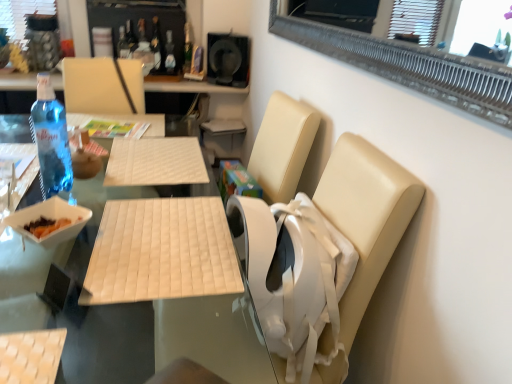
Question: Does white quilted placemat at center, the second table from the top, have a lesser height compared to transparent plastic bottle at upper center, the second bottle in the bottom-to-top sequence?

Choices:
 (A) yes
 (B) no

Answer: (B)

Question: Is white quilted placemat at center, the second table from the top, behind transparent plastic bottle at upper center, acting as the 3th bottle starting from the top?

Choices:
 (A) yes
 (B) no

Answer: (B)

Question: Does white quilted placemat at center, acting as the first table starting from the bottom, have a lesser width compared to transparent plastic bottle at upper center, the second bottle in the bottom-to-top sequence?

Choices:
 (A) yes
 (B) no

Answer: (B)

Question: Is white quilted placemat at center, the second table from the top, closer to camera compared to transparent plastic bottle at upper center, marked as the second bottle in a back-to-front arrangement?

Choices:
 (A) no
 (B) yes

Answer: (B)

Question: Does white quilted placemat at center, acting as the first table starting from the bottom, appear on the left side of transparent plastic bottle at upper center, marked as the second bottle in a back-to-front arrangement?

Choices:
 (A) yes
 (B) no

Answer: (A)

Question: From the image's perspective, is white quilted placemat at center, the second table from the top, on transparent plastic bottle at upper center, acting as the 3th bottle starting from the top?

Choices:
 (A) yes
 (B) no

Answer: (B)

Question: Can white quilted mat at center, marked as the first table in a top-to-bottom arrangement, be found inside white quilted placemat at center, the second table from the top?

Choices:
 (A) no
 (B) yes

Answer: (B)

Question: Can you confirm if white quilted placemat at center, the second table from the top, is thinner than white quilted mat at center, the second table in the bottom-to-top sequence?

Choices:
 (A) yes
 (B) no

Answer: (B)

Question: Is white quilted placemat at center, the second table from the top, positioned beyond the bounds of white quilted mat at center, marked as the first table in a top-to-bottom arrangement?

Choices:
 (A) no
 (B) yes

Answer: (B)

Question: Is white quilted placemat at center, the second table from the top, looking in the opposite direction of white quilted mat at center, the second table in the bottom-to-top sequence?

Choices:
 (A) yes
 (B) no

Answer: (B)

Question: From the image's perspective, is white quilted placemat at center, acting as the first table starting from the bottom, located above white quilted mat at center, the second table in the bottom-to-top sequence?

Choices:
 (A) no
 (B) yes

Answer: (A)

Question: Is white quilted placemat at center, the second table from the top, positioned far away from white quilted mat at center, marked as the first table in a top-to-bottom arrangement?

Choices:
 (A) no
 (B) yes

Answer: (A)

Question: Is transparent plastic bottle at upper center, which is the third bottle in front-to-back order, closer to the viewer compared to blue glass bottle at left, positioned as the fourth bottle in back-to-front order?

Choices:
 (A) yes
 (B) no

Answer: (B)